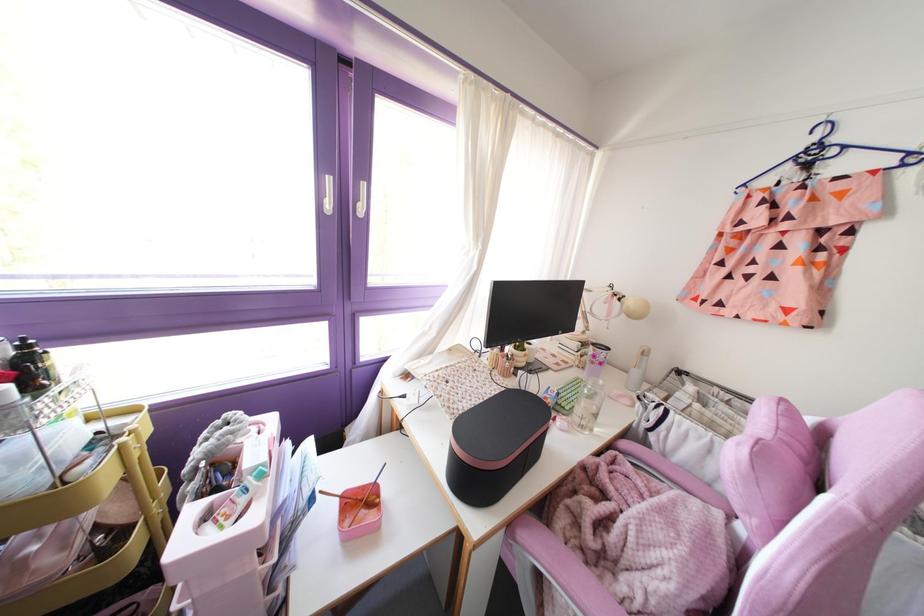
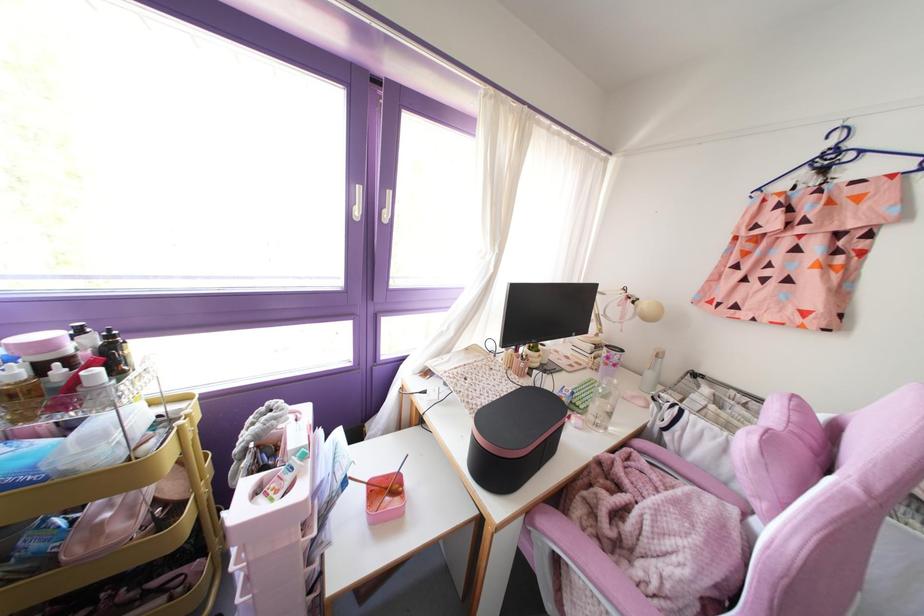
Where in the second image is the point corresponding to the point at 329,205 from the first image?

(357, 212)